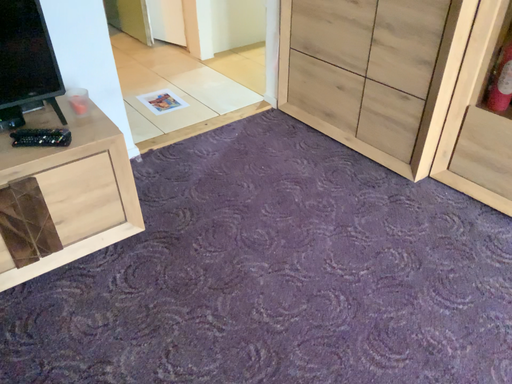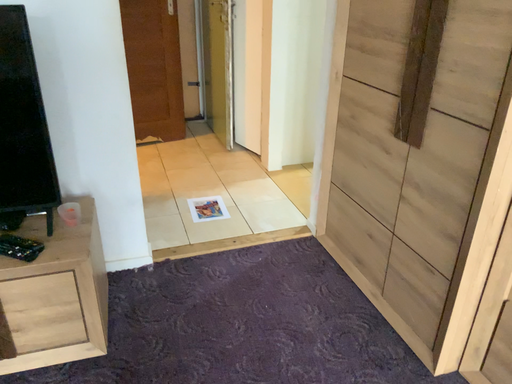
Question: How did the camera likely rotate when shooting the video?

Choices:
 (A) rotated upward
 (B) rotated downward

Answer: (A)